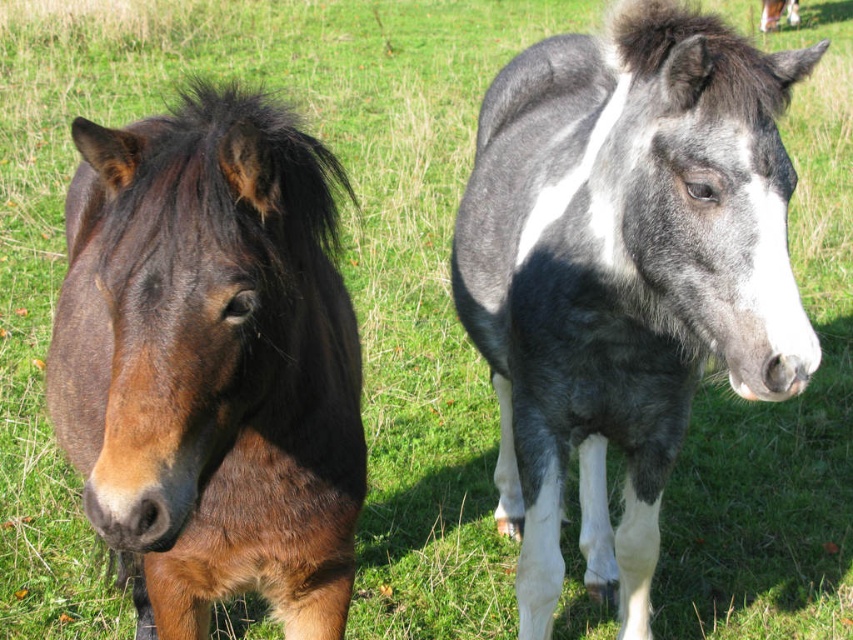
Question: Which point appears closest to the camera in this image?

Choices:
 (A) (776, 10)
 (B) (747, 259)
 (C) (238, 211)

Answer: (C)

Question: Can you confirm if speckled gray horse at center is positioned to the right of brown glossy horse at center?

Choices:
 (A) no
 (B) yes

Answer: (B)

Question: Estimate the real-world distances between objects in this image. Which object is farther from the white glossy horse at upper right?

Choices:
 (A) speckled gray horse at center
 (B) brown glossy horse at center

Answer: (B)

Question: Which point appears farthest from the camera in this image?

Choices:
 (A) (669, 221)
 (B) (247, 164)
 (C) (766, 26)

Answer: (C)

Question: Can you confirm if speckled gray horse at center is positioned to the right of brown glossy horse at center?

Choices:
 (A) no
 (B) yes

Answer: (B)

Question: Does brown glossy horse at center come behind white glossy horse at upper right?

Choices:
 (A) no
 (B) yes

Answer: (A)